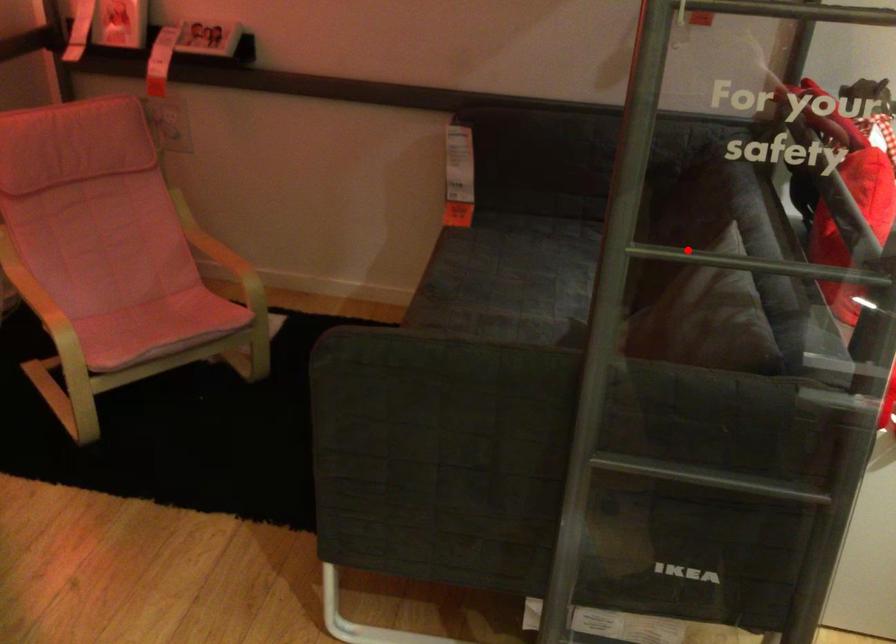
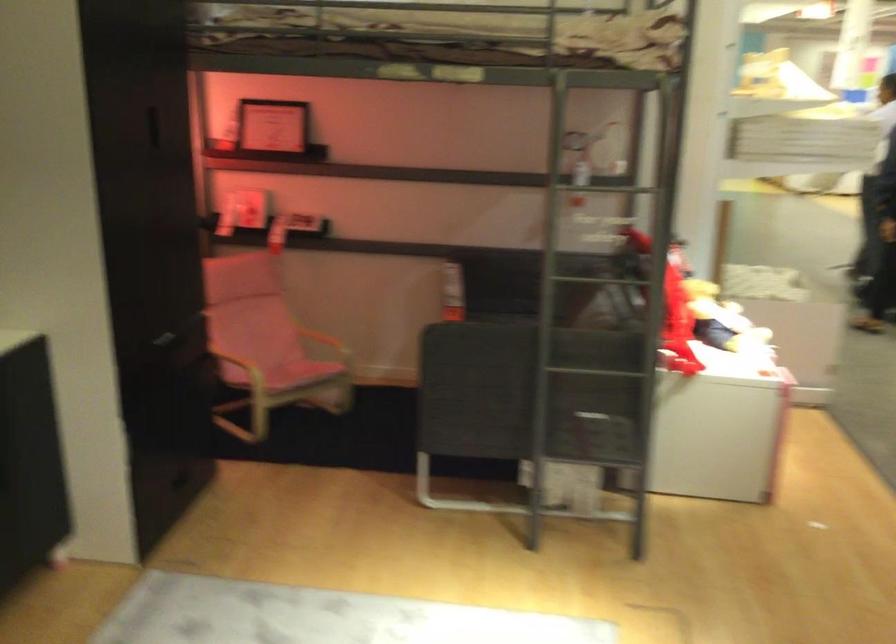
Where in the second image is the point corresponding to the highlighted location from the first image?

(591, 278)